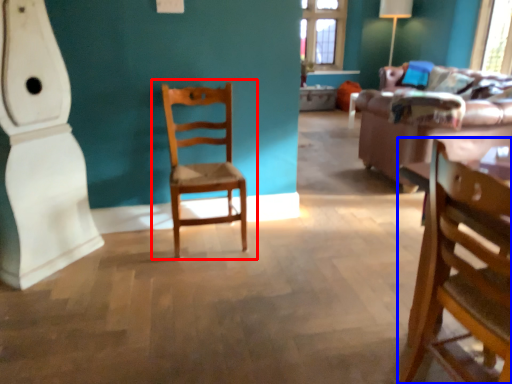
Question: Among these objects, which one is farthest to the camera, chair (highlighted by a red box) or chair (highlighted by a blue box)?

Choices:
 (A) chair
 (B) chair

Answer: (A)